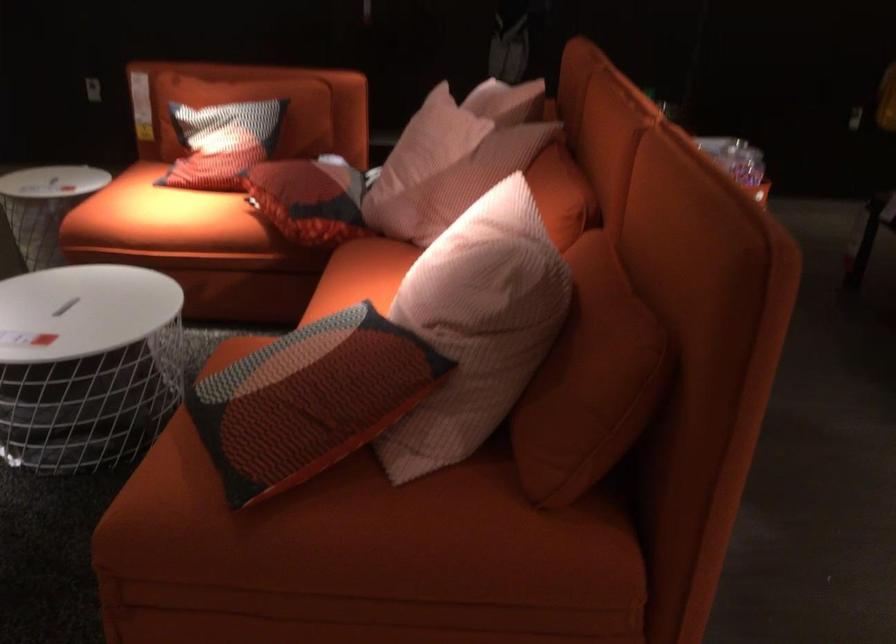
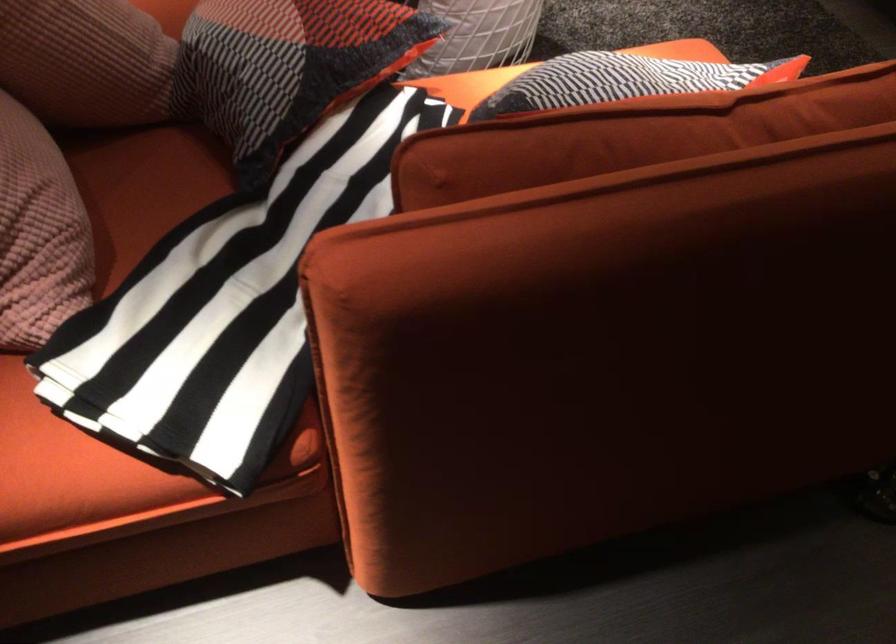
Locate, in the second image, the point that corresponds to point 323,167 in the first image.

(288, 67)